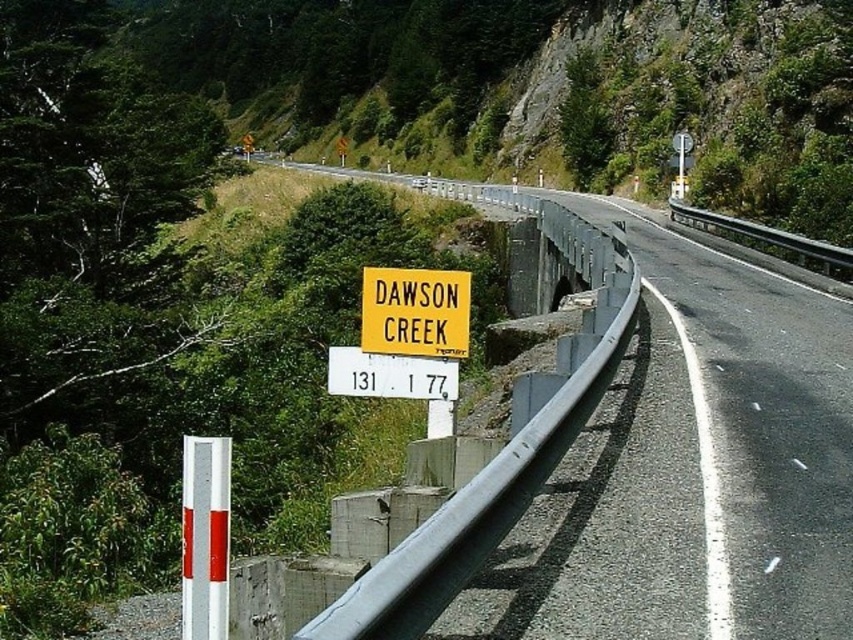
You are a driver approaching the yellow plastic sign at center and the yellow matte sign at center. Which one do you see first as you drive along the road?

The yellow plastic sign at center is bigger than the yellow matte sign at center, so you will see the yellow plastic sign at center first because larger objects are noticed before smaller ones when approaching.

You are a driver approaching the yellow plastic sign at center and the yellow matte sign at center. Which one is positioned more to the right side of the road?

The yellow plastic sign at center is positioned more to the right side of the road than the yellow matte sign at center.